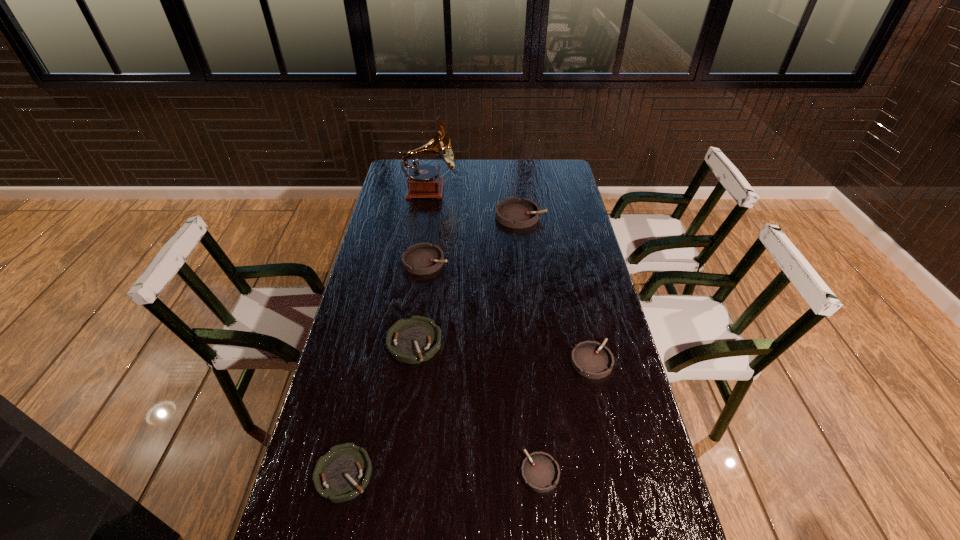
At what (x,y) coordinates should I click in order to perform the action: click on the tallest object. Please return your answer as a coordinate pair (x, y). Image resolution: width=960 pixels, height=540 pixels. Looking at the image, I should click on (423, 181).

Identify the location of the sixth shortest object. The width and height of the screenshot is (960, 540). (513, 212).

You are a GUI agent. You are given a task and a screenshot of the screen. Output one action in this format:
    pyautogui.click(x=<x>, y=<y>)
    Task: Click on the farthest ashtray
    The width and height of the screenshot is (960, 540).
    Given the screenshot: What is the action you would take?
    pyautogui.click(x=513, y=212)

Identify the location of the leftmost gray ashtray. The height and width of the screenshot is (540, 960). (422, 258).

This screenshot has width=960, height=540. I want to click on the third nearest gray ashtray, so click(422, 258).

At what (x,y) coordinates should I click in order to perform the action: click on the third farthest gray ashtray. Please return your answer as a coordinate pair (x, y). This screenshot has width=960, height=540. Looking at the image, I should click on (591, 359).

What are the coordinates of `the farther green ashtray` in the screenshot? It's located at [416, 339].

The width and height of the screenshot is (960, 540). Find the location of `the smallest gray ashtray`. the smallest gray ashtray is located at coordinates (540, 472).

Find the location of a particular element. the smaller green ashtray is located at coordinates (344, 472).

This screenshot has height=540, width=960. What are the coordinates of `free region located 0.340m on the horn of the tallest object` in the screenshot? It's located at pos(530,190).